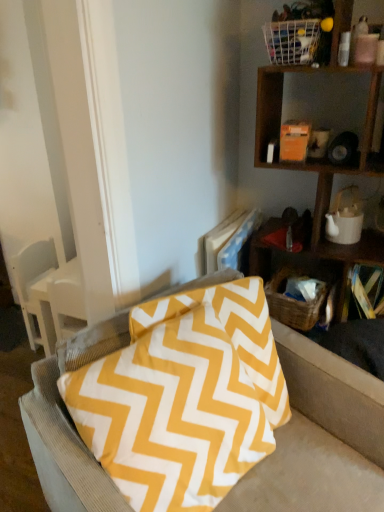
Question: From the image's perspective, is white wire basket at upper right, which is the second basket from back to front, above yellow zigzag-patterned pillow at right?

Choices:
 (A) yes
 (B) no

Answer: (A)

Question: Are white wire basket at upper right, which ranks as the second basket in bottom-to-top order, and yellow zigzag-patterned pillow at right located far from each other?

Choices:
 (A) no
 (B) yes

Answer: (A)

Question: From a real-world perspective, is white wire basket at upper right, positioned as the first basket in front-to-back order, located beneath yellow zigzag-patterned pillow at right?

Choices:
 (A) no
 (B) yes

Answer: (A)

Question: From a real-world perspective, is white wire basket at upper right, which is the second basket from back to front, on yellow zigzag-patterned pillow at right?

Choices:
 (A) no
 (B) yes

Answer: (B)

Question: Can we say white wire basket at upper right, positioned as the first basket in front-to-back order, lies outside yellow zigzag-patterned pillow at right?

Choices:
 (A) yes
 (B) no

Answer: (A)

Question: Considering the relative sizes of white wire basket at upper right, positioned as the first basket in front-to-back order, and yellow zigzag-patterned pillow at right in the image provided, is white wire basket at upper right, positioned as the first basket in front-to-back order, thinner than yellow zigzag-patterned pillow at right?

Choices:
 (A) no
 (B) yes

Answer: (B)

Question: Are yellow zigzag-patterned pillow at right and white ceramic teapot at upper right located far from each other?

Choices:
 (A) no
 (B) yes

Answer: (A)

Question: Considering the relative positions of yellow zigzag-patterned pillow at right and white ceramic teapot at upper right in the image provided, is yellow zigzag-patterned pillow at right to the left of white ceramic teapot at upper right from the viewer's perspective?

Choices:
 (A) yes
 (B) no

Answer: (B)

Question: Is yellow zigzag-patterned pillow at right bigger than white ceramic teapot at upper right?

Choices:
 (A) yes
 (B) no

Answer: (A)

Question: From the image's perspective, is yellow zigzag-patterned pillow at right under white ceramic teapot at upper right?

Choices:
 (A) yes
 (B) no

Answer: (A)

Question: Is yellow zigzag-patterned pillow at right outside of white ceramic teapot at upper right?

Choices:
 (A) yes
 (B) no

Answer: (A)

Question: Is yellow zigzag-patterned pillow at right looking in the opposite direction of white ceramic teapot at upper right?

Choices:
 (A) no
 (B) yes

Answer: (A)

Question: Does white wire basket at upper right, the 1th basket positioned from the top, have a greater width compared to yellow fabric pillow at center?

Choices:
 (A) no
 (B) yes

Answer: (B)